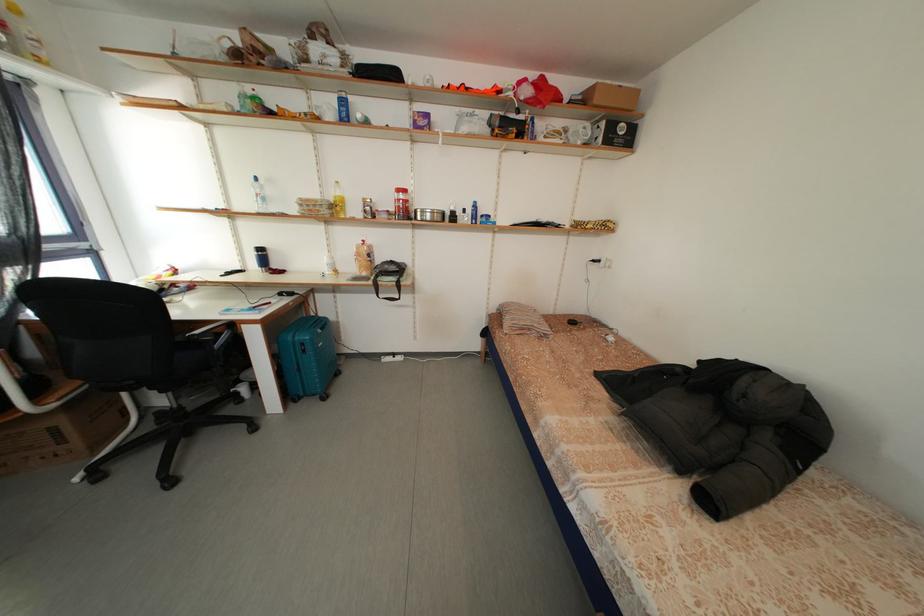
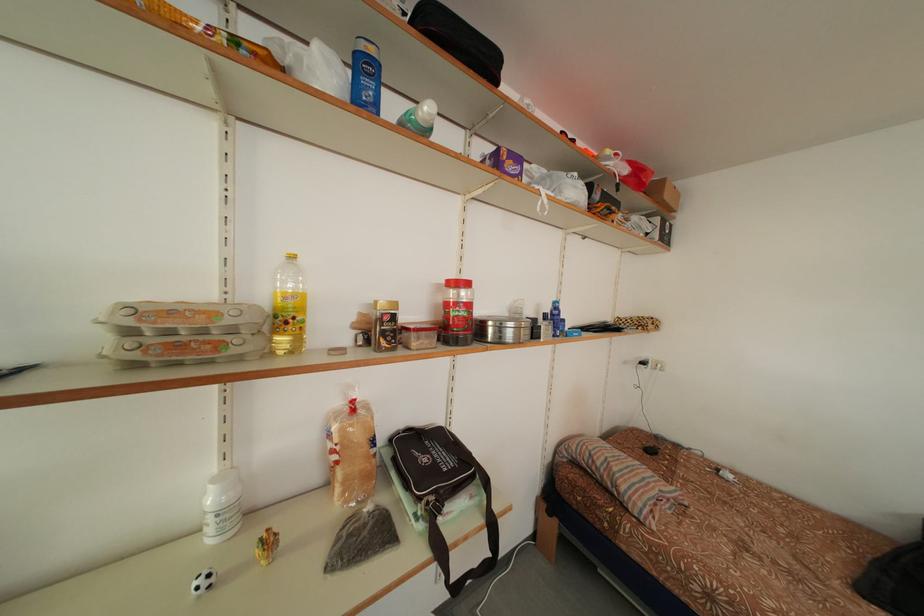
Find the pixel in the second image that matches [604,105] in the first image.

(675, 201)